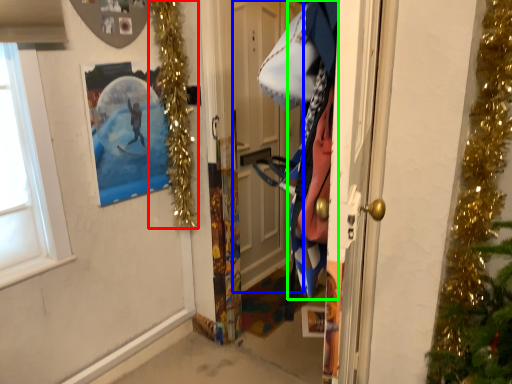
Question: Which object is positioned closest to christmas light (highlighted by a red box)? Select from door (highlighted by a blue box) and clothing (highlighted by a green box).

Choices:
 (A) door
 (B) clothing

Answer: (A)